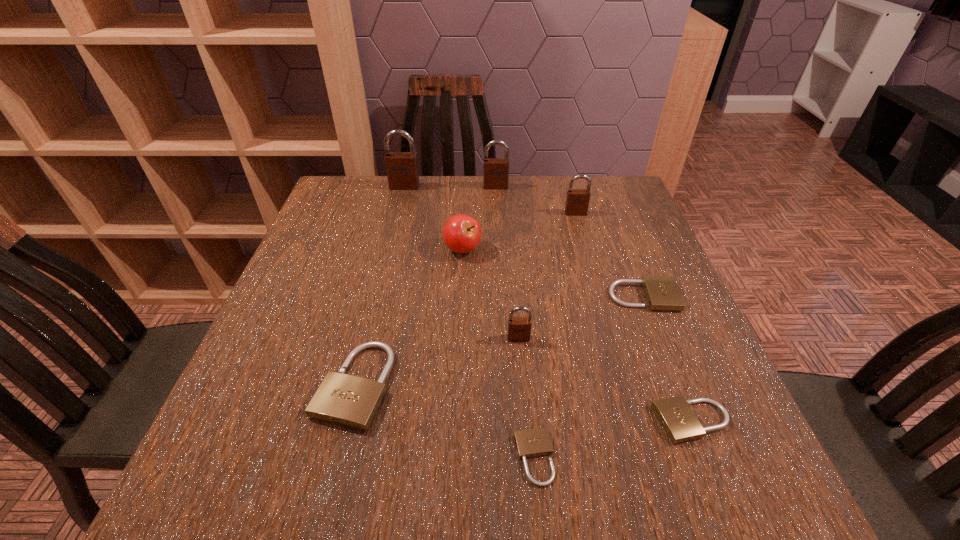
This screenshot has width=960, height=540. What are the coordinates of `free spot between the tallest object and the red apple` in the screenshot? It's located at (434, 218).

Locate an element on the screen. This screenshot has height=540, width=960. blank region between the nearest brown padlock and the sixth shortest padlock is located at coordinates click(x=547, y=275).

The width and height of the screenshot is (960, 540). In order to click on free area in between the fourth farthest object and the third tallest padlock in this screenshot , I will do `click(519, 231)`.

You are a GUI agent. You are given a task and a screenshot of the screen. Output one action in this format:
    pyautogui.click(x=<x>, y=<y>)
    Task: Click on the vacant area that lies between the red apple and the fourth nearest padlock
    The image size is (960, 540).
    Given the screenshot: What is the action you would take?
    pyautogui.click(x=491, y=294)

Where is `free space between the seventh shortest object and the shortest padlock`? The image size is (960, 540). free space between the seventh shortest object and the shortest padlock is located at coordinates (555, 335).

Locate an element on the screen. Image resolution: width=960 pixels, height=540 pixels. free space between the fifth tallest padlock and the fifth nearest object is located at coordinates (499, 341).

Locate which object is the sixth closest to the leftmost beige padlock. Please provide its 2D coordinates. Your answer should be formatted as a tuple, i.e. [(x, y)], where the tuple contains the x and y coordinates of a point satisfying the conditions above.

[(402, 167)]

Identify which object is the third closest to the shortest padlock. Please provide its 2D coordinates. Your answer should be formatted as a tuple, i.e. [(x, y)], where the tuple contains the x and y coordinates of a point satisfying the conditions above.

[(349, 401)]

Identify which padlock is located as the nearest to the biggest beige padlock. Please provide its 2D coordinates. Your answer should be formatted as a tuple, i.e. [(x, y)], where the tuple contains the x and y coordinates of a point satisfying the conditions above.

[(519, 328)]

Locate which padlock ranks second in proximity to the smallest beige padlock. Please provide its 2D coordinates. Your answer should be formatted as a tuple, i.e. [(x, y)], where the tuple contains the x and y coordinates of a point satisfying the conditions above.

[(519, 328)]